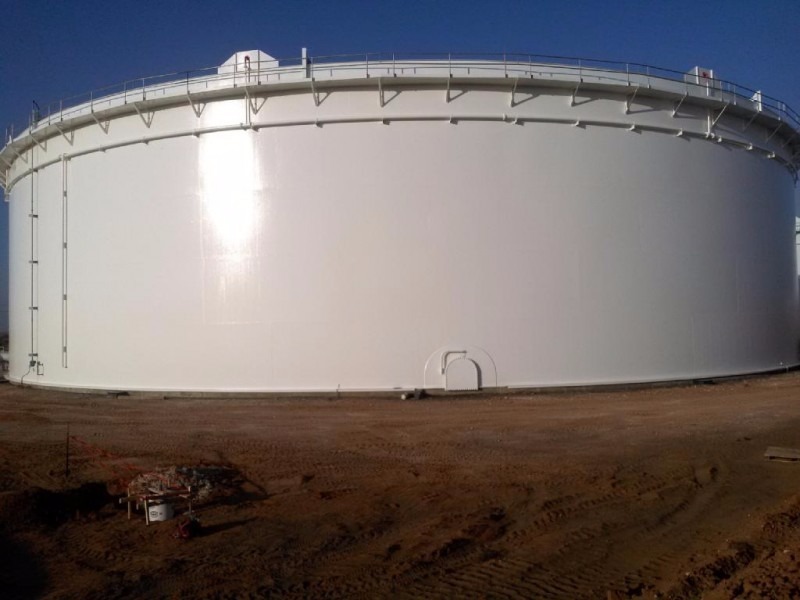
You are a GUI agent. You are given a task and a screenshot of the screen. Output one action in this format:
    pyautogui.click(x=<x>, y=<y>)
    Task: Click on the plug
    
    Given the screenshot: What is the action you would take?
    pyautogui.click(x=22, y=376)